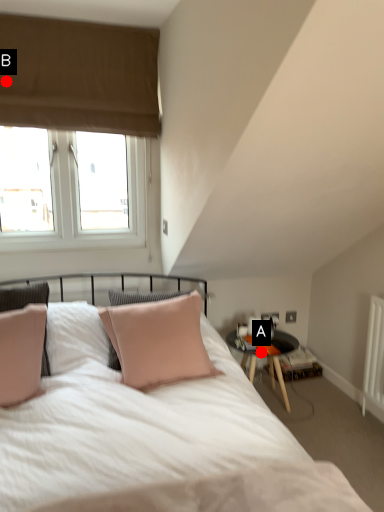
Question: Two points are circled on the image, labeled by A and B beside each circle. Which point appears closest to the camera in this image?

Choices:
 (A) A is closer
 (B) B is closer

Answer: (B)